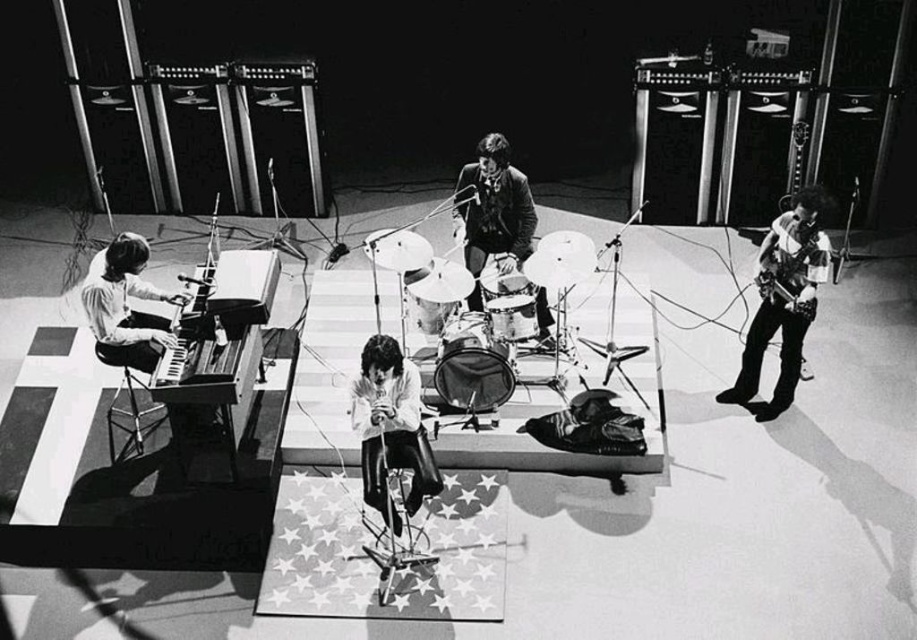
Question: Does white leather jacket at center come behind shiny silver guitar at right?

Choices:
 (A) no
 (B) yes

Answer: (A)

Question: Is shiny black guitar at right to the left of leather jacket at center from the viewer's perspective?

Choices:
 (A) yes
 (B) no

Answer: (B)

Question: Estimate the real-world distances between objects in this image. Which object is farther from the shiny black guitar at right?

Choices:
 (A) smooth black piano at left
 (B) shiny silver guitar at right
 (C) leather jacket at center

Answer: (A)

Question: Among these objects, which one is farthest from the camera?

Choices:
 (A) leather jacket at center
 (B) smooth black piano at left
 (C) shiny silver guitar at right
 (D) white leather jacket at center

Answer: (A)

Question: Is shiny black guitar at right smaller than smooth black piano at left?

Choices:
 (A) yes
 (B) no

Answer: (B)

Question: Which point is closer to the camera?

Choices:
 (A) leather jacket at center
 (B) shiny black guitar at right
 (C) smooth black piano at left

Answer: (B)